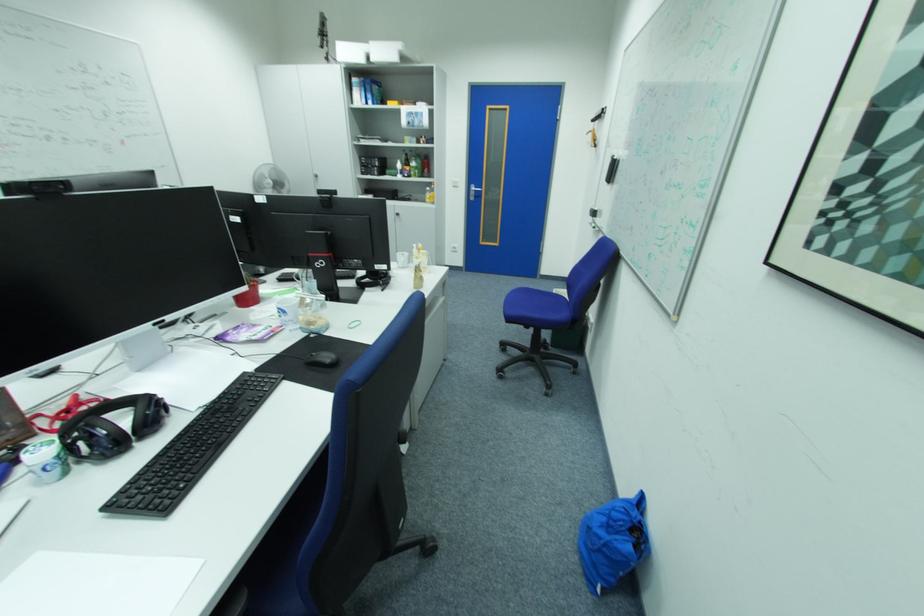
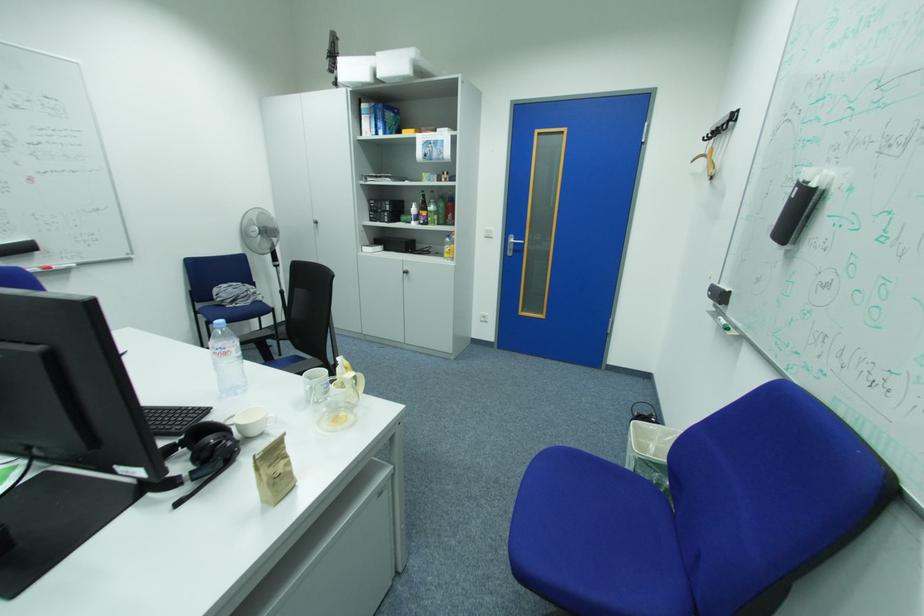
Find the pixel in the second image that matches (x=432, y=253) in the first image.

(359, 374)